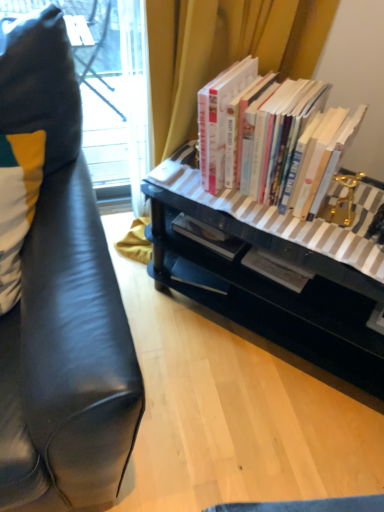
Where is `blank space above black glossy desk at center (from a real-world perspective)`? blank space above black glossy desk at center (from a real-world perspective) is located at coordinates (314, 222).